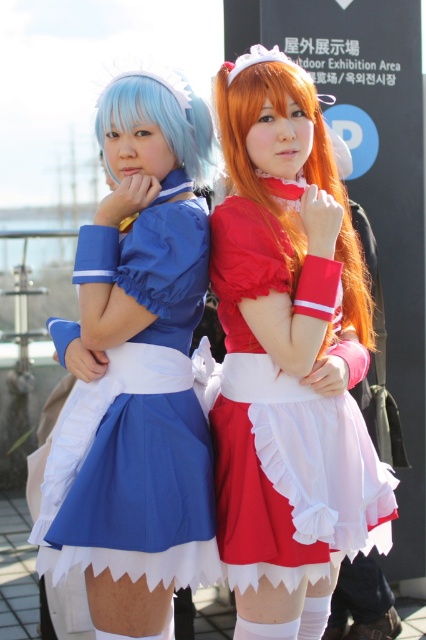
You are a photographer trying to adjust the lighting for a photo shoot. You notice the matte blue fabric dress at left and the matte blue wig at upper left. Which object is closer to the camera?

The matte blue fabric dress at left is closer to the camera than the matte blue wig at upper left because the distance between them is 22.30 inches, implying the dress is in front.

You are a photographer adjusting the camera settings for a photo shoot. You need to focus on the matte blue fabric dress at left. Where exactly should you direct the camera lens to ensure proper focus?

You should direct the camera lens to point at coordinates (143, 227) to focus on the matte blue fabric dress at left.